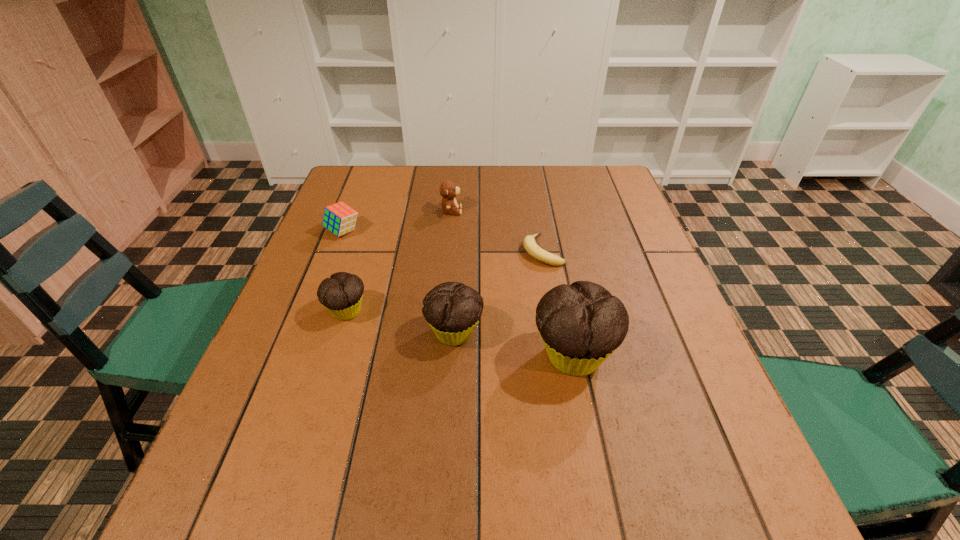
Locate an element on the screen. This screenshot has height=540, width=960. the leftmost muffin is located at coordinates [x=342, y=293].

Image resolution: width=960 pixels, height=540 pixels. Find the location of `the second shortest muffin`. the second shortest muffin is located at coordinates (452, 310).

Where is `the second muffin from right to left`? The height and width of the screenshot is (540, 960). the second muffin from right to left is located at coordinates 452,310.

At what (x,y) coordinates should I click in order to perform the action: click on the tallest object. Please return your answer as a coordinate pair (x, y). The image size is (960, 540). Looking at the image, I should click on pyautogui.click(x=581, y=325).

You are a GUI agent. You are given a task and a screenshot of the screen. Output one action in this format:
    pyautogui.click(x=<x>, y=<y>)
    Task: Click on the tallest muffin
    Image resolution: width=960 pixels, height=540 pixels.
    Given the screenshot: What is the action you would take?
    pyautogui.click(x=581, y=325)

Locate an element on the screen. banana is located at coordinates (531, 247).

Identify the location of cube. The width and height of the screenshot is (960, 540). (339, 218).

Where is `the farthest object`? This screenshot has width=960, height=540. the farthest object is located at coordinates (448, 190).

You are a GUI agent. You are given a task and a screenshot of the screen. Output one action in this format:
    pyautogui.click(x=<x>, y=<y>)
    Task: Click on the vacant space located on the back of the shortest muffin
    
    Given the screenshot: What is the action you would take?
    pyautogui.click(x=362, y=260)

The height and width of the screenshot is (540, 960). Identify the location of vacant space located on the right of the second muffin from left to right. [x=563, y=333].